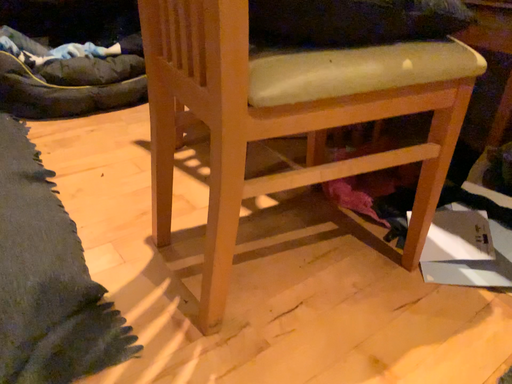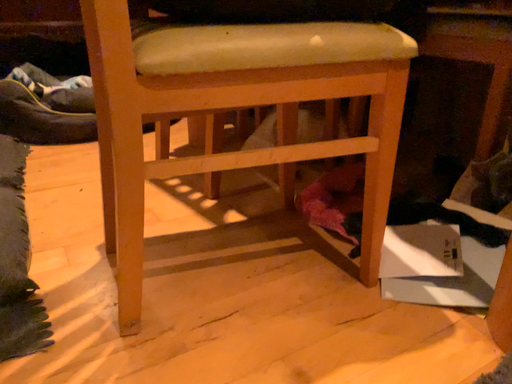
Question: How did the camera likely rotate when shooting the video?

Choices:
 (A) rotated upward
 (B) rotated downward

Answer: (A)